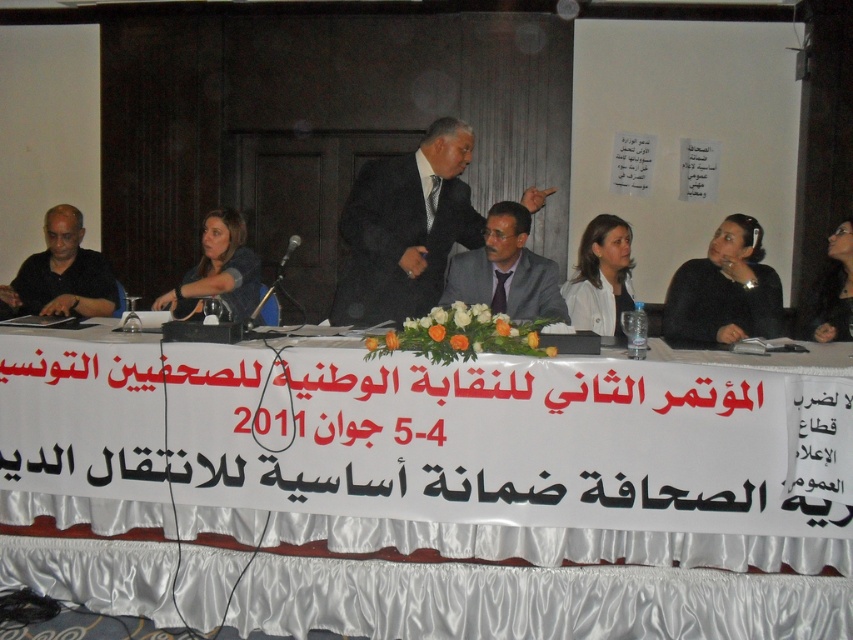
Which is below, white satin tablecloth at center or matte black shirt at left?

white satin tablecloth at center is below.

Is white satin tablecloth at center further to the viewer compared to matte black shirt at left?

No.

Measure the distance between white satin tablecloth at center and camera.

white satin tablecloth at center is 8.87 feet from camera.

Where is `white satin tablecloth at center`? The width and height of the screenshot is (853, 640). white satin tablecloth at center is located at coordinates (503, 493).

Does gray suit at center have a greater height compared to white matte jacket at center?

No.

Between point (502, 276) and point (628, 253), which one is positioned behind?

The point (628, 253) is behind.

Is point (454, 300) positioned after point (606, 218)?

No, (454, 300) is closer to viewer.

The image size is (853, 640). What are the coordinates of `gray suit at center` in the screenshot? It's located at (506, 269).

Looking at this image, does gray suit at center appear on the right side of matte black jacket at left?

Correct, you'll find gray suit at center to the right of matte black jacket at left.

Which is behind, point (514, 202) or point (184, 282)?

Positioned behind is point (514, 202).

Is point (532, 252) closer to camera compared to point (231, 289)?

No.

This screenshot has height=640, width=853. I want to click on gray suit at center, so click(506, 269).